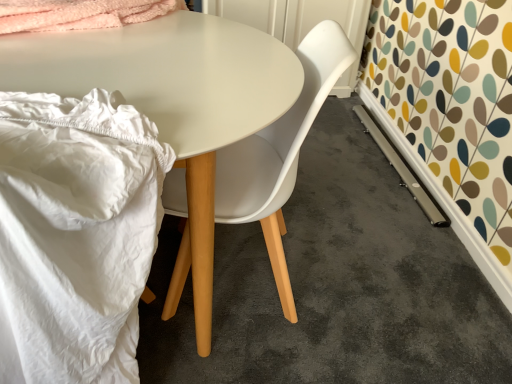
At what (x,y) coordinates should I click in order to perform the action: click on vacant space to the right of white plastic chair at center. Please return your answer as a coordinate pair (x, y). Looking at the image, I should click on (365, 281).